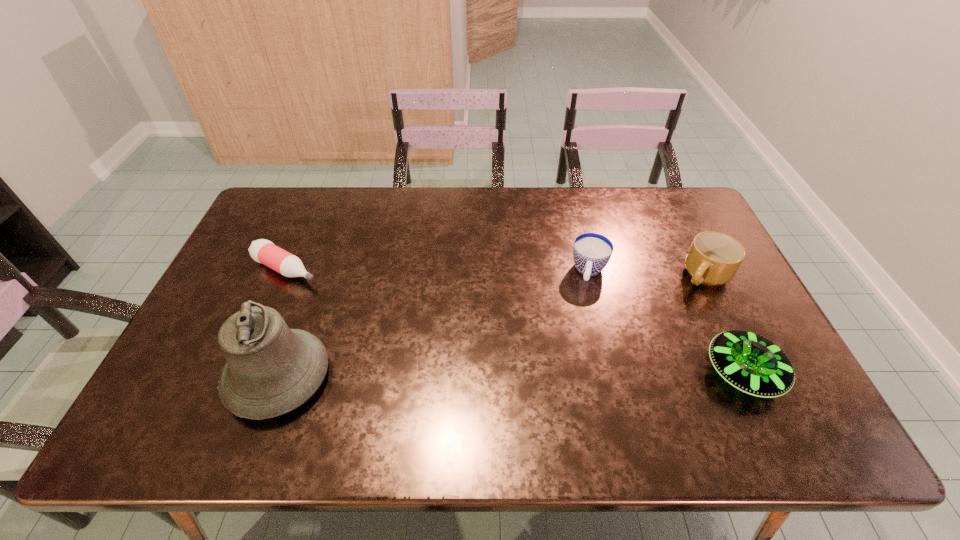
Image resolution: width=960 pixels, height=540 pixels. In order to click on the tallest object in this screenshot , I will do `click(271, 369)`.

The width and height of the screenshot is (960, 540). What are the coordinates of `saucer` in the screenshot? It's located at (751, 363).

The width and height of the screenshot is (960, 540). Find the location of `bottle`. bottle is located at coordinates (263, 251).

Identify the location of cup. (591, 252).

This screenshot has width=960, height=540. Find the location of `mug`. mug is located at coordinates (713, 258).

Locate an element on the screen. The width and height of the screenshot is (960, 540). free space located on the right of the tallest object is located at coordinates coord(466,377).

You are a GUI agent. You are given a task and a screenshot of the screen. Output one action in this format:
    pyautogui.click(x=<x>, y=<y>)
    Task: Click on the vacant region located on the back of the saucer
    
    Given the screenshot: What is the action you would take?
    pyautogui.click(x=689, y=259)

This screenshot has height=540, width=960. Identify the location of vacant space situated 0.070m with the cap open on the bottle. (329, 288).

Locate an element on the screen. Image resolution: width=960 pixels, height=540 pixels. free space located with the cap open on the bottle is located at coordinates (329, 288).

Identify the location of free space located with the cap open on the bottle. (345, 296).